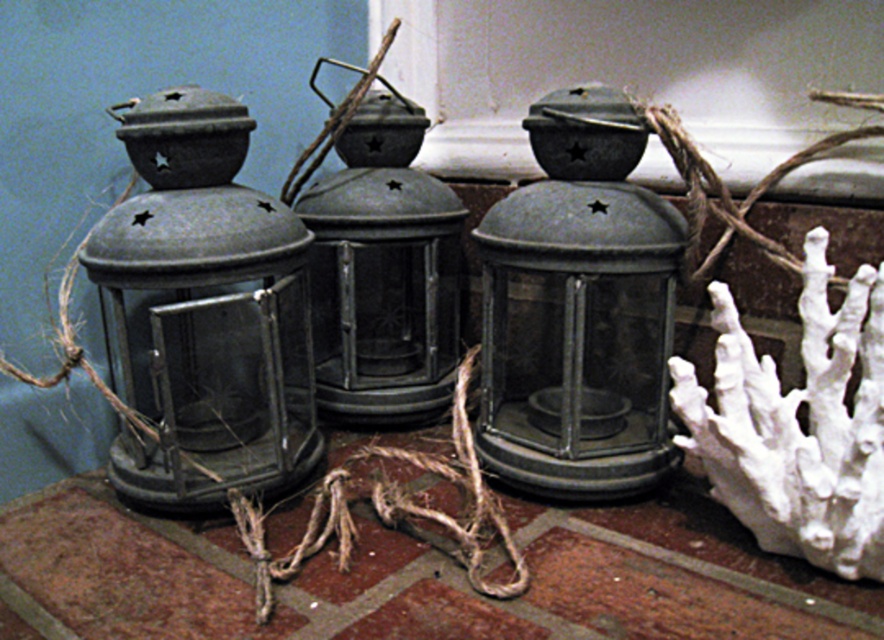
You are standing in front of the lantern display and want to hang a new lantern between the two points marked as point (453, 289) and point (386, 515). Based on their positions, which point is closer to you?

Point (386, 515) is closer to you because it is in front of point (453, 289).

You are an interior designer arranging items on a shelf. You have a matte metal lantern at center and a rustic twine at center. If you want to place both items side by side without overlapping, which item should be placed first to ensure there is enough space?

The matte metal lantern at center has a lesser width compared to rustic twine at center, so you should place the rustic twine at center first to accommodate its larger width, then place the matte metal lantern at center next to it.

You are setting up a display for a nautical themed event and have a matte black lantern at center and rustic twine at center. The display requires that the object with the greater height be placed on the higher shelf. Which object should be placed on the higher shelf?

The matte black lantern at center is much taller than rustic twine at center, so it should be placed on the higher shelf.